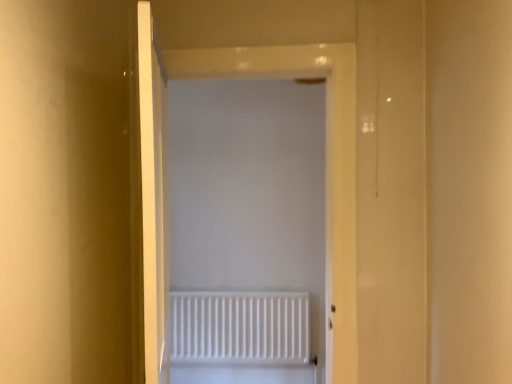
What is the approximate width of white matte radiator at center?

white matte radiator at center is 2.67 centimeters in width.

Image resolution: width=512 pixels, height=384 pixels. Describe the element at coordinates (240, 327) in the screenshot. I see `white matte radiator at center` at that location.

You are a GUI agent. You are given a task and a screenshot of the screen. Output one action in this format:
    pyautogui.click(x=<x>, y=<y>)
    Task: Click on the white matte radiator at center
    The width and height of the screenshot is (512, 384).
    Given the screenshot: What is the action you would take?
    pyautogui.click(x=240, y=327)

Identify the location of white matte radiator at center. The image size is (512, 384). (327, 155).

What do you see at coordinates (327, 155) in the screenshot? The height and width of the screenshot is (384, 512). I see `white matte radiator at center` at bounding box center [327, 155].

Locate an element on the screen. The image size is (512, 384). white matte radiator at center is located at coordinates (240, 327).

Can you confirm if white matte radiator at center is positioned to the left of white matte radiator at center?

Indeed, white matte radiator at center is positioned on the left side of white matte radiator at center.

Is white matte radiator at center further to camera compared to white matte radiator at center?

Yes, it is behind white matte radiator at center.

Considering the positions of points (281, 311) and (271, 73), is point (281, 311) closer to camera compared to point (271, 73)?

No, (281, 311) is behind (271, 73).

From the image's perspective, is white matte radiator at center under white matte radiator at center?

Correct, white matte radiator at center appears lower than white matte radiator at center in the image.

From a real-world perspective, which object rests below the other?

From a 3D spatial view, white matte radiator at center is below.

Which object is wider, white matte radiator at center or white matte radiator at center?

With larger width is white matte radiator at center.

Does white matte radiator at center have a lesser height compared to white matte radiator at center?

Indeed, white matte radiator at center has a lesser height compared to white matte radiator at center.

Based on their sizes in the image, would you say white matte radiator at center is bigger or smaller than white matte radiator at center?

white matte radiator at center is smaller than white matte radiator at center.

Is white matte radiator at center situated inside white matte radiator at center or outside?

white matte radiator at center is not enclosed by white matte radiator at center.

Is white matte radiator at center directly adjacent to white matte radiator at center?

No.

Is white matte radiator at center facing away from white matte radiator at center?

No, white matte radiator at center is not at the back of white matte radiator at center.

Where is `radiator that appears on the left of white matte radiator at center`? The width and height of the screenshot is (512, 384). radiator that appears on the left of white matte radiator at center is located at coordinates (240, 327).

Considering the positions of objects white matte radiator at center and white matte radiator at center in the image provided, who is more to the left, white matte radiator at center or white matte radiator at center?

white matte radiator at center is more to the left.

Is white matte radiator at center further to the viewer compared to white matte radiator at center?

No, white matte radiator at center is in front of white matte radiator at center.

Considering the positions of points (352, 178) and (275, 354), is point (352, 178) closer to camera compared to point (275, 354)?

That is True.

From the image's perspective, which is above, white matte radiator at center or white matte radiator at center?

white matte radiator at center.

From a real-world perspective, is white matte radiator at center positioned over white matte radiator at center based on gravity?

Indeed, from a real-world perspective, white matte radiator at center stands above white matte radiator at center.

Between white matte radiator at center and white matte radiator at center, which one has smaller width?

Thinner between the two is white matte radiator at center.

Which of these two, white matte radiator at center or white matte radiator at center, stands shorter?

white matte radiator at center is shorter.

Which of these two, white matte radiator at center or white matte radiator at center, is smaller?

white matte radiator at center.

Would you say white matte radiator at center is outside white matte radiator at center?

white matte radiator at center lies outside white matte radiator at center's area.

Is there a large distance between white matte radiator at center and white matte radiator at center?

Yes, white matte radiator at center and white matte radiator at center are quite far apart.

Is white matte radiator at center looking in the opposite direction of white matte radiator at center?

Yes, white matte radiator at center's orientation is away from white matte radiator at center.

What's the angular difference between white matte radiator at center and white matte radiator at center's facing directions?

The angular difference between white matte radiator at center and white matte radiator at center is 1.91 degrees.

This screenshot has height=384, width=512. What are the coordinates of `radiator that is under the white matte radiator at center (from a real-world perspective)` in the screenshot? It's located at (240, 327).

Identify the location of radiator beneath the white matte radiator at center (from a real-world perspective). The width and height of the screenshot is (512, 384). (240, 327).

Where is `door that is on the right side of white matte radiator at center`? Image resolution: width=512 pixels, height=384 pixels. door that is on the right side of white matte radiator at center is located at coordinates (327, 155).